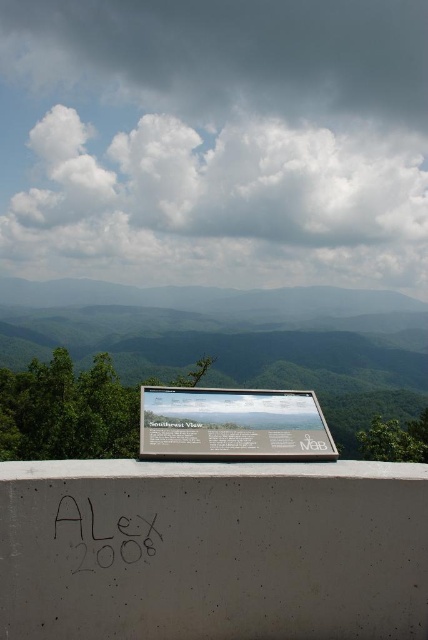
Question: Which object appears closest to the camera in this image?

Choices:
 (A) black marker graffiti at center
 (B) concrete at center
 (C) white fluffy cloud at upper center

Answer: (B)

Question: Estimate the real-world distances between objects in this image. Which object is closer to the white fluffy cloud at upper center?

Choices:
 (A) white glossy signboard at center
 (B) green matte signboard at lower center

Answer: (B)

Question: Which point appears farthest from the camera in this image?

Choices:
 (A) (246, 451)
 (B) (107, 320)
 (C) (213, 602)
 (D) (134, 531)

Answer: (B)

Question: Can you confirm if concrete at center is bigger than white glossy signboard at center?

Choices:
 (A) yes
 (B) no

Answer: (A)

Question: Does concrete at center appear over white glossy signboard at center?

Choices:
 (A) yes
 (B) no

Answer: (B)

Question: Does green matte signboard at lower center lie behind white glossy signboard at center?

Choices:
 (A) yes
 (B) no

Answer: (A)